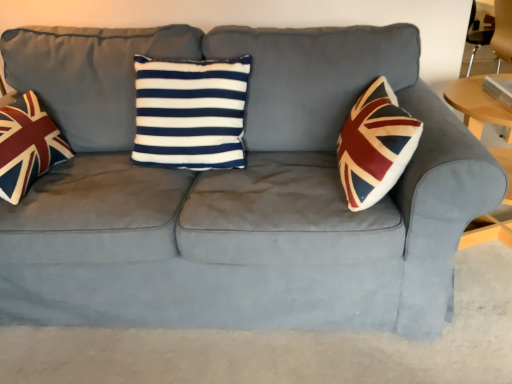
Question: Visually, is wooden round table at right positioned to the left or to the right of union jack fabric pillow at left?

Choices:
 (A) right
 (B) left

Answer: (A)

Question: Do you think wooden round table at right is within union jack fabric pillow at left, or outside of it?

Choices:
 (A) inside
 (B) outside

Answer: (B)

Question: Based on their relative distances, which object is nearer to the navy blue/white striped cushion at center?

Choices:
 (A) wooden round table at right
 (B) union jack fabric pillow at left

Answer: (B)

Question: Based on their relative distances, which object is farther from the wooden round table at right?

Choices:
 (A) navy blue/white striped cushion at center
 (B) union jack fabric pillow at left

Answer: (B)